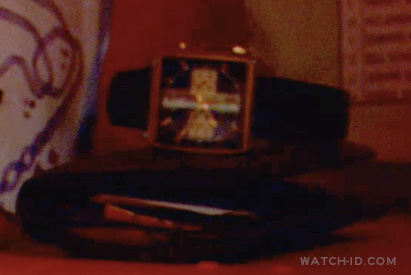
Locate an element on the screen. table is located at coordinates point(52,268).